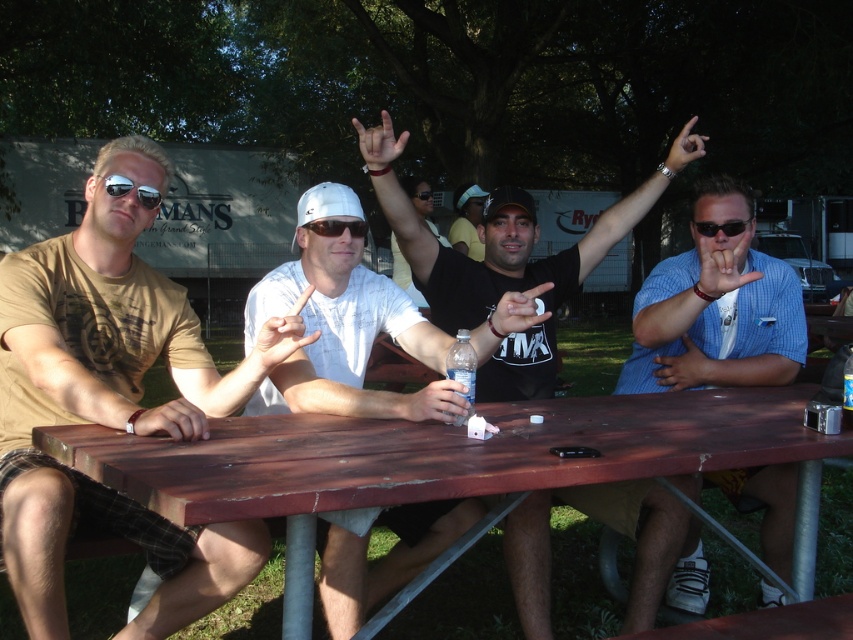
Question: Which point is farther to the camera?

Choices:
 (A) (473, 252)
 (B) (260, 394)
 (C) (409, 186)
 (D) (461, 401)

Answer: (A)

Question: Which point is farther to the camera?

Choices:
 (A) (368, 132)
 (B) (480, 252)

Answer: (B)

Question: Does matte brown t-shirt at left have a lesser width compared to black plastic sunglasses at center?

Choices:
 (A) yes
 (B) no

Answer: (B)

Question: Can you confirm if white matte cap at center is bigger than matte black sunglasses at center?

Choices:
 (A) no
 (B) yes

Answer: (B)

Question: Does white matte cap at center have a larger size compared to matte black sunglasses at center?

Choices:
 (A) no
 (B) yes

Answer: (B)

Question: Which object appears closest to the camera in this image?

Choices:
 (A) matte black sunglasses at left
 (B) blue checkered shirt at right
 (C) matte plastic bottle at center
 (D) matte black t-shirt at center

Answer: (C)